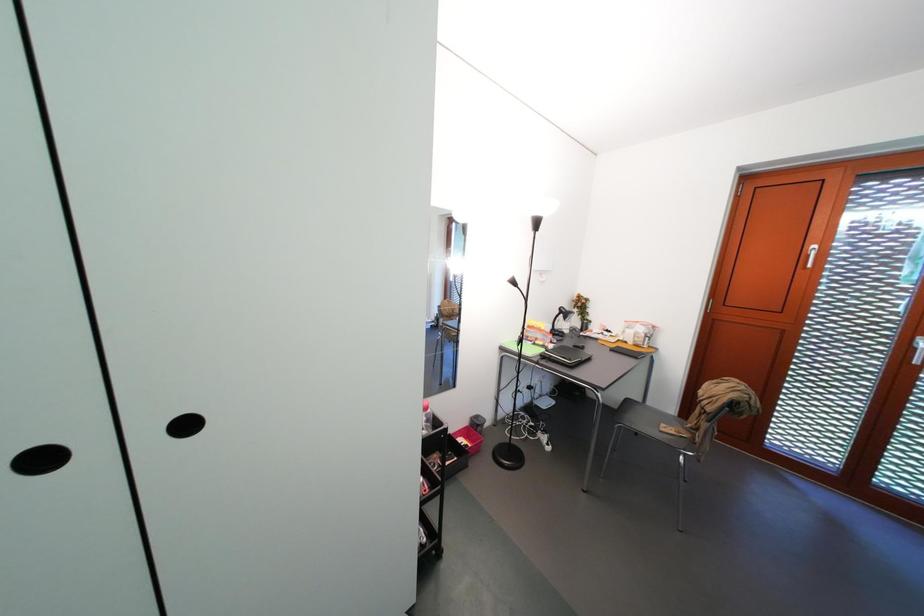
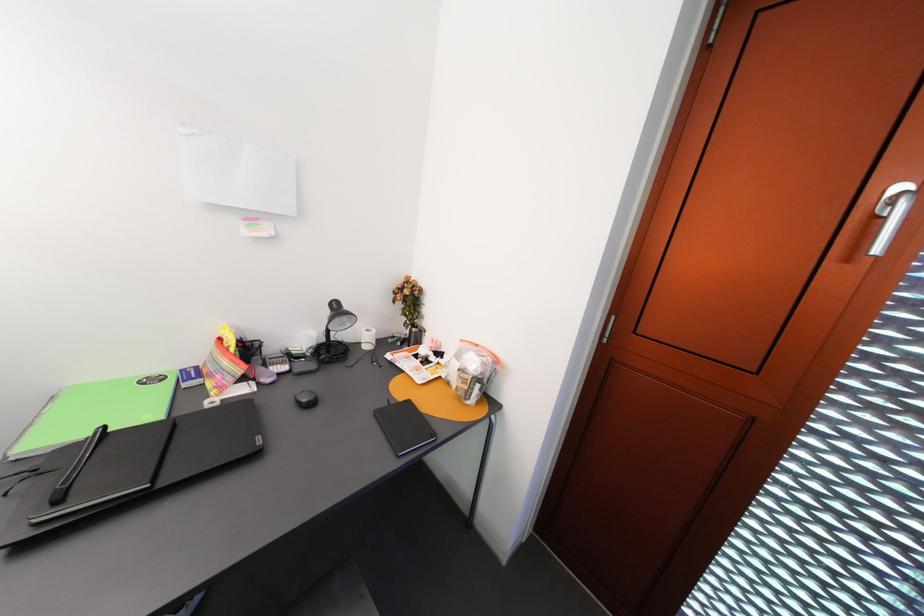
In a continuous first-person perspective shot, in which direction is the camera moving?

The movement direction of the cameraman is right, forward.